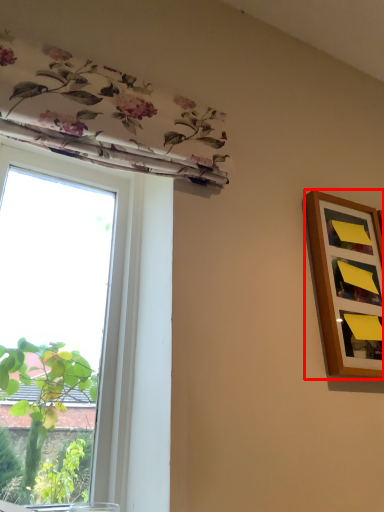
Question: Considering the relative positions of picture frame (annotated by the red box) and window in the image provided, where is picture frame (annotated by the red box) located with respect to the staircase?

Choices:
 (A) right
 (B) left

Answer: (A)